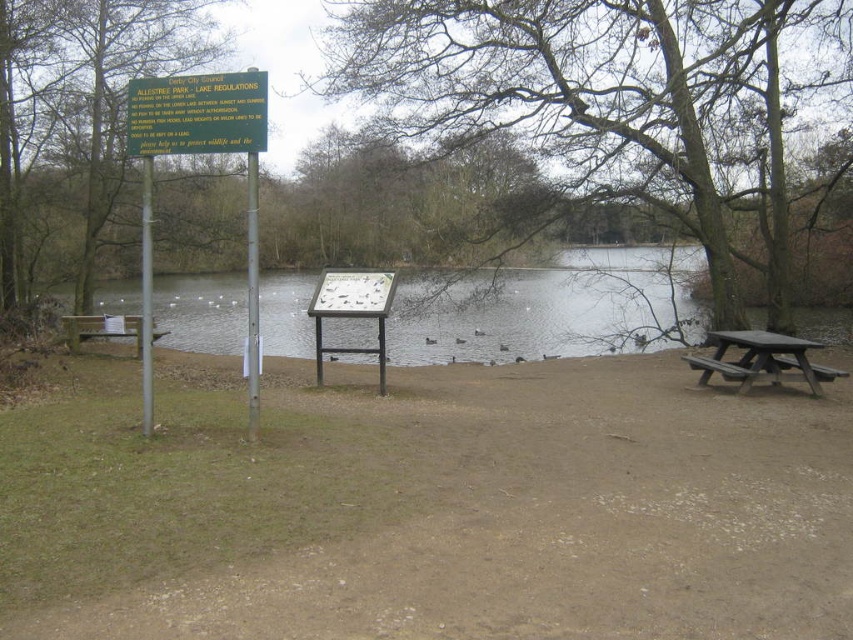
Is bare branches at center thinner than green sign at left?

No.

Who is higher up, bare branches at center or green sign at left?

green sign at left is above.

Does point (579, 186) come farther from viewer compared to point (160, 36)?

No.

The image size is (853, 640). I want to click on bare branches at center, so click(596, 99).

Does point (141, 100) come behind point (759, 369)?

No, (141, 100) is closer to viewer.

Which is in front, point (177, 132) or point (778, 371)?

Point (177, 132) is in front.

Between point (206, 118) and point (718, 336), which one is positioned behind?

The point (718, 336) is behind.

You are a GUI agent. You are given a task and a screenshot of the screen. Output one action in this format:
    pyautogui.click(x=<x>, y=<y>)
    Task: Click on the green plastic sign at upper center
    The height and width of the screenshot is (640, 853).
    Given the screenshot: What is the action you would take?
    pyautogui.click(x=196, y=113)

Does bare branches at center lie in front of dark brown wooden picnic table at lower right?

No.

Is point (769, 272) farther from camera compared to point (728, 369)?

Yes, point (769, 272) is farther from viewer.

Is point (764, 147) farther from viewer compared to point (815, 390)?

Yes, it is.

Image resolution: width=853 pixels, height=640 pixels. I want to click on bare branches at center, so click(596, 99).